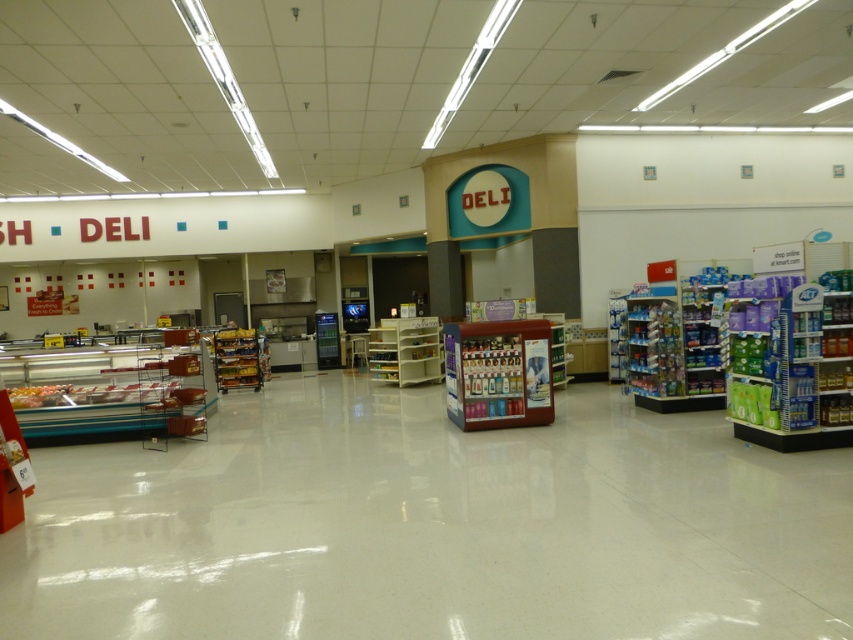
The height and width of the screenshot is (640, 853). What do you see at coordinates (432, 525) in the screenshot?
I see `white glossy floor at center` at bounding box center [432, 525].

Measure the distance between point (x=146, y=573) and camera.

Point (x=146, y=573) and camera are 4.57 meters apart.

Does point (25, 541) come closer to viewer compared to point (515, 368)?

That is True.

The height and width of the screenshot is (640, 853). What are the coordinates of `white glossy floor at center` in the screenshot? It's located at [x=432, y=525].

Which of these two, blue plastic shelf at right or wooden shelf at center, stands taller?

blue plastic shelf at right is taller.

From the picture: How far apart are blue plastic shelf at right and wooden shelf at center?

7.72 meters

Who is more forward, (747, 406) or (395, 330)?

Point (747, 406)

Locate an element on the screen. blue plastic shelf at right is located at coordinates (790, 380).

Is metallic red beverage cooler at center wider than metallic silver shelves at center?

Indeed, metallic red beverage cooler at center has a greater width compared to metallic silver shelves at center.

The height and width of the screenshot is (640, 853). Identify the location of metallic red beverage cooler at center. (498, 372).